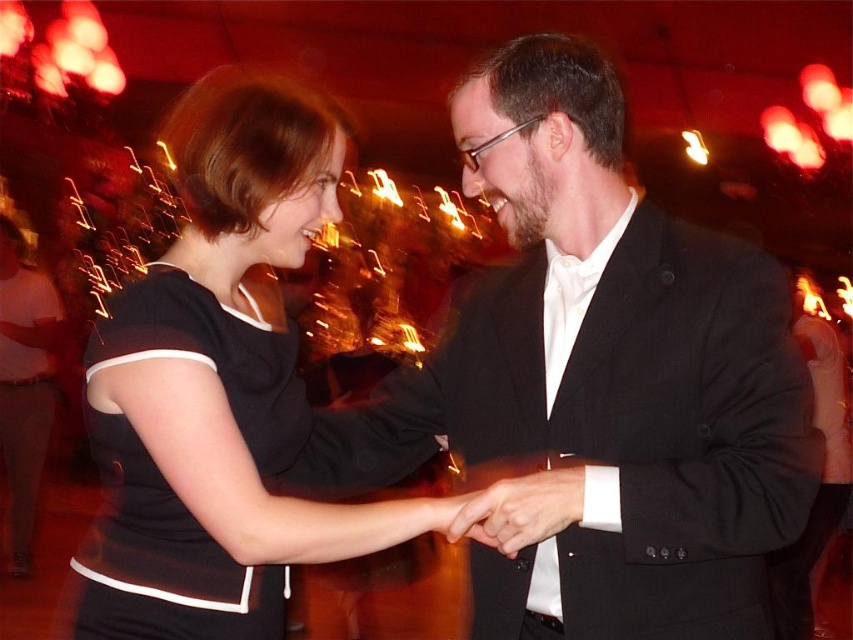
You are a photographer at the event and want to capture a closeup shot of the black matte dress at center and the matte black hand at center. Which object is wider when framed in the camera?

The black matte dress at center is wider than the matte black hand at center, so the black matte dress at center will appear wider in the photo.

You are a photographer standing at the camera position. You want to take a photo of the black suit at center. Can you reach it with your hand to adjust it before taking the photo?

The black suit at center is 1.18 meters from camera, so you can reach it with your hand to adjust it before taking the photo since it is within arm reach.

You are at the party and want to move from the point closer to you to the farther point. Which path should you take? The points are point (113,358) and point (212,552). Please describe the direction you need to move in terms of left, right, forward, or backward.

To move from the closer point (113,358) to the farther point (212,552), you should move forward and to the right. Since point (113,358) is closer, moving forward would take you towards the direction of the farther point, and the coordinates suggest a rightward shift from the first to the second point.